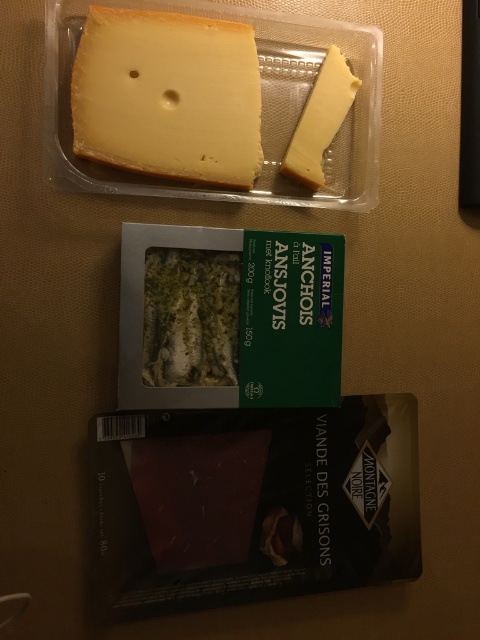
Question: Can you confirm if yellowish matte cheese at upper left is positioned to the left of yellow cheese at upper right?

Choices:
 (A) yes
 (B) no

Answer: (A)

Question: Among these objects, which one is farthest from the camera?

Choices:
 (A) yellow cheese at upper right
 (B) yellowish matte cheese at upper left

Answer: (A)

Question: Which object appears farthest from the camera in this image?

Choices:
 (A) yellowish matte cheese at upper left
 (B) yellow cheese at upper right

Answer: (B)

Question: Does yellowish matte cheese at upper left have a lesser width compared to yellow cheese at upper right?

Choices:
 (A) no
 (B) yes

Answer: (A)

Question: Does greenish-white flaky at center have a larger size compared to yellow cheese at upper right?

Choices:
 (A) yes
 (B) no

Answer: (A)

Question: Among these points, which one is nearest to the camera?

Choices:
 (A) (331, 116)
 (B) (74, 113)
 (C) (157, 355)

Answer: (B)